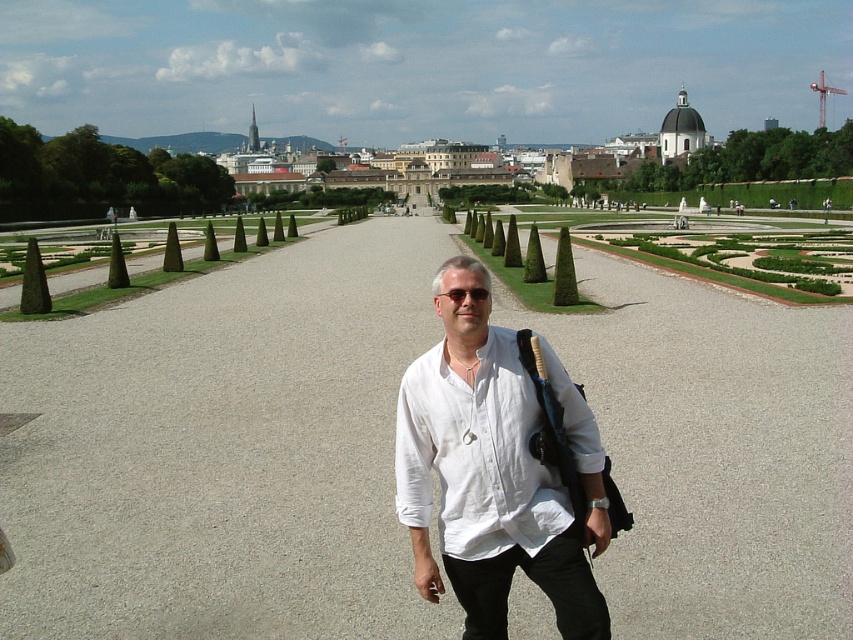
Question: Which point is farther from the camera taking this photo?

Choices:
 (A) (328, 189)
 (B) (473, 291)

Answer: (A)

Question: Which object is positioned farthest from the white cotton shirt at center?

Choices:
 (A) black plastic sunglasses at center
 (B) green coniferous hedge at center

Answer: (B)

Question: Can you confirm if white cotton shirt at center is positioned to the left of black plastic sunglasses at center?

Choices:
 (A) yes
 (B) no

Answer: (B)

Question: Does green coniferous hedge at center have a smaller size compared to black plastic sunglasses at center?

Choices:
 (A) no
 (B) yes

Answer: (A)

Question: Which object is closer to the camera taking this photo?

Choices:
 (A) green coniferous hedge at center
 (B) black plastic sunglasses at center
 (C) green coniferous hedge at upper left
 (D) white stone palace at upper center

Answer: (B)

Question: Is gray gravel path at center to the left of green coniferous hedge at upper left from the viewer's perspective?

Choices:
 (A) no
 (B) yes

Answer: (A)